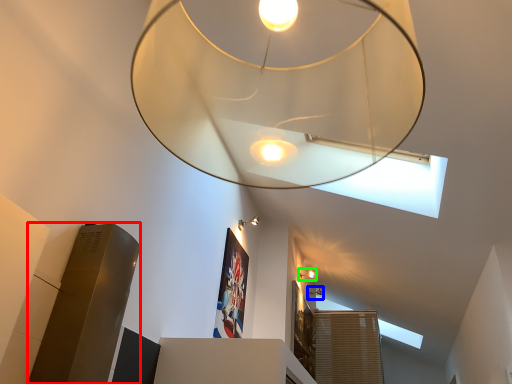
Question: Which object is positioned farthest from lift (highlighted by a red box)? Select from lamp (highlighted by a blue box) and lamp (highlighted by a green box).

Choices:
 (A) lamp
 (B) lamp

Answer: (A)